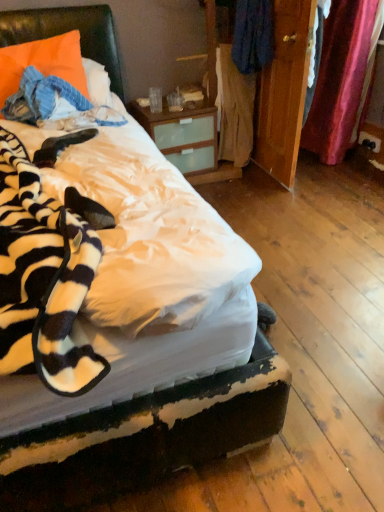
Question: From the image's perspective, is light brown fabric at center, which ranks as the 1th clothing in bottom-to-top order, located above black plastic power outlet at lower right?

Choices:
 (A) yes
 (B) no

Answer: (A)

Question: Can you confirm if light brown fabric at center, the 2th clothing when ordered from top to bottom, is bigger than black plastic power outlet at lower right?

Choices:
 (A) yes
 (B) no

Answer: (A)

Question: Is light brown fabric at center, the 2th clothing when ordered from top to bottom, with black plastic power outlet at lower right?

Choices:
 (A) no
 (B) yes

Answer: (A)

Question: From a real-world perspective, is light brown fabric at center, which ranks as the 1th clothing in bottom-to-top order, located higher than black plastic power outlet at lower right?

Choices:
 (A) yes
 (B) no

Answer: (A)

Question: Is light brown fabric at center, the 2th clothing when ordered from top to bottom, aimed at black plastic power outlet at lower right?

Choices:
 (A) yes
 (B) no

Answer: (B)

Question: In terms of size, does black plastic power outlet at lower right appear bigger or smaller than orange fabric pillow at upper left?

Choices:
 (A) small
 (B) big

Answer: (A)

Question: From a real-world perspective, relative to orange fabric pillow at upper left, is black plastic power outlet at lower right vertically above or below?

Choices:
 (A) below
 (B) above

Answer: (A)

Question: In terms of width, does black plastic power outlet at lower right look wider or thinner when compared to orange fabric pillow at upper left?

Choices:
 (A) thin
 (B) wide

Answer: (A)

Question: Is black plastic power outlet at lower right to the left or to the right of orange fabric pillow at upper left in the image?

Choices:
 (A) right
 (B) left

Answer: (A)

Question: In the image, is black plastic power outlet at lower right positioned in front of or behind blue fabric at center, which appears as the first clothing when viewed from the top?

Choices:
 (A) behind
 (B) front

Answer: (A)

Question: Would you say black plastic power outlet at lower right is inside or outside blue fabric at center, marked as the second clothing in a bottom-to-top arrangement?

Choices:
 (A) inside
 (B) outside

Answer: (B)

Question: Visually, is black plastic power outlet at lower right positioned to the left or to the right of blue fabric at center, which appears as the first clothing when viewed from the top?

Choices:
 (A) right
 (B) left

Answer: (A)

Question: Does point (359, 143) appear closer or farther from the camera than point (254, 32)?

Choices:
 (A) farther
 (B) closer

Answer: (A)

Question: From the image's perspective, relative to blue fabric at center, which appears as the first clothing when viewed from the top, is light brown fabric at center, which ranks as the 1th clothing in bottom-to-top order, above or below?

Choices:
 (A) above
 (B) below

Answer: (B)

Question: Based on their sizes in the image, would you say light brown fabric at center, the 2th clothing when ordered from top to bottom, is bigger or smaller than blue fabric at center, which appears as the first clothing when viewed from the top?

Choices:
 (A) big
 (B) small

Answer: (A)